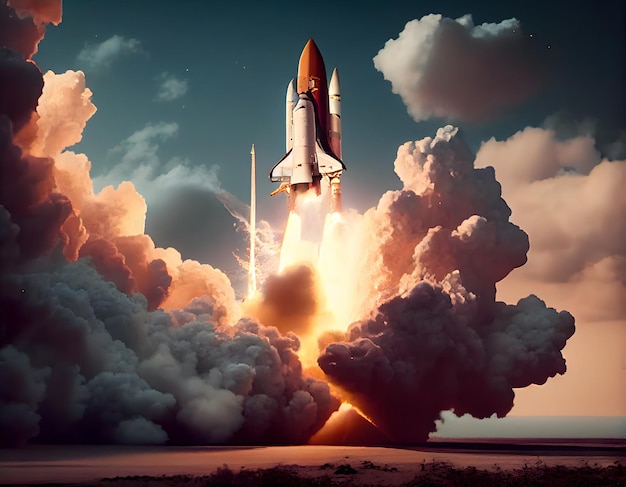
Locate an element on the screen. The image size is (626, 487). bottom right corner empty space is located at coordinates (622, 482).